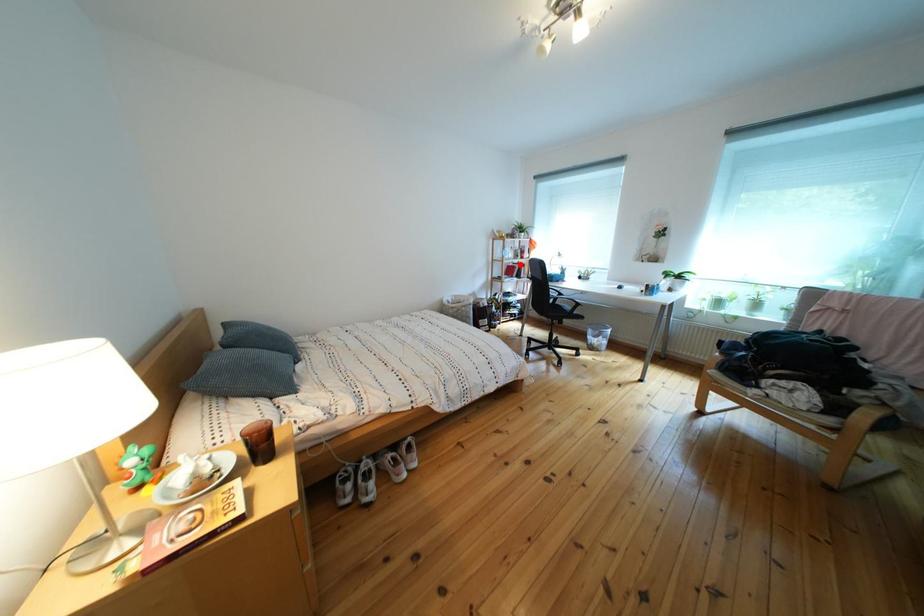
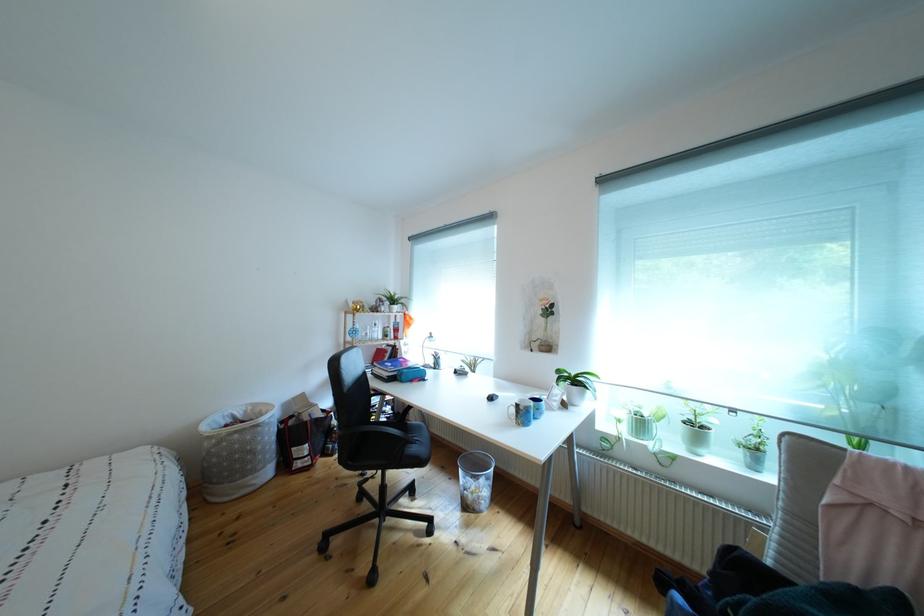
Locate, in the second image, the point that corresponds to the highlighted location in the first image.

(383, 345)